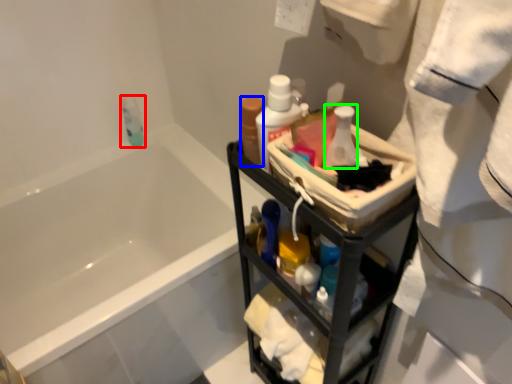
Question: Which object is the closest to the mouthwash (highlighted by a red box)? Choose among these: mouthwash (highlighted by a blue box) or toiletry (highlighted by a green box).

Choices:
 (A) mouthwash
 (B) toiletry

Answer: (A)